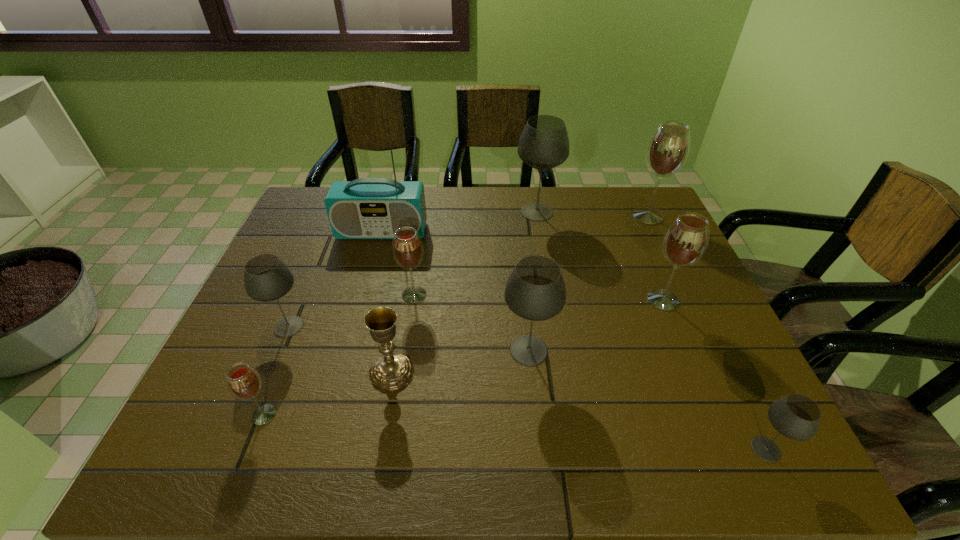
Locate an element on the screen. This screenshot has width=960, height=540. the smallest red wineglass is located at coordinates (244, 383).

At what (x,y) coordinates should I click in order to perform the action: click on the ninth farthest object. Please return your answer as a coordinate pair (x, y). The width and height of the screenshot is (960, 540). Looking at the image, I should click on (244, 383).

Where is `the nearest wineglass`? the nearest wineglass is located at coordinates (795, 416).

Find the location of a particular element. the nearest gray wineglass is located at coordinates (795, 416).

You are a GUI agent. You are given a task and a screenshot of the screen. Output one action in this format:
    pyautogui.click(x=<x>, y=<y>)
    Task: Click on the vacant region located on the front panel of the tallest object
    The height and width of the screenshot is (540, 960).
    Given the screenshot: What is the action you would take?
    pyautogui.click(x=356, y=326)

You are a GUI agent. You are given a task and a screenshot of the screen. Output one action in this format:
    pyautogui.click(x=<x>, y=<y>)
    Task: Click on the free space located on the front of the biggest gray wineglass
    
    Given the screenshot: What is the action you would take?
    pyautogui.click(x=552, y=304)

The height and width of the screenshot is (540, 960). Identify the location of blank space located 0.050m on the back of the farthest red wineglass. (639, 198).

What are the coordinates of `free spot located on the left of the second biggest gray wineglass` in the screenshot? It's located at (370, 350).

Find the location of `vacant space situated on the back of the third smallest red wineglass`. vacant space situated on the back of the third smallest red wineglass is located at coordinates (643, 254).

Where is `free space located 0.220m on the back of the third red wineglass from right to left`? free space located 0.220m on the back of the third red wineglass from right to left is located at coordinates (423, 235).